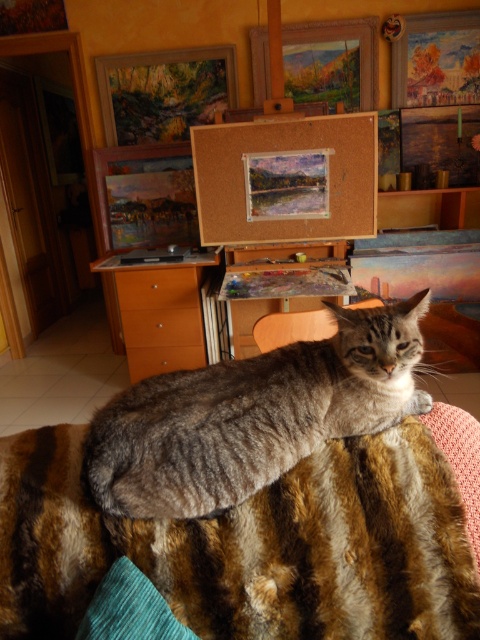
Question: Which object is the farthest from the striped fur blanket at center?

Choices:
 (A) gray striped fur cat at center
 (B) corkboard at center

Answer: (B)

Question: Does gray striped fur cat at center appear on the left side of corkboard at center?

Choices:
 (A) yes
 (B) no

Answer: (A)

Question: Which point is closer to the camera?

Choices:
 (A) (392, 600)
 (B) (220, 228)

Answer: (A)

Question: Does striped fur blanket at center have a smaller size compared to gray striped fur cat at center?

Choices:
 (A) yes
 (B) no

Answer: (B)

Question: Does striped fur blanket at center appear on the left side of corkboard at center?

Choices:
 (A) no
 (B) yes

Answer: (B)

Question: Which is nearer to the gray striped fur cat at center?

Choices:
 (A) striped fur blanket at center
 (B) corkboard at center

Answer: (A)